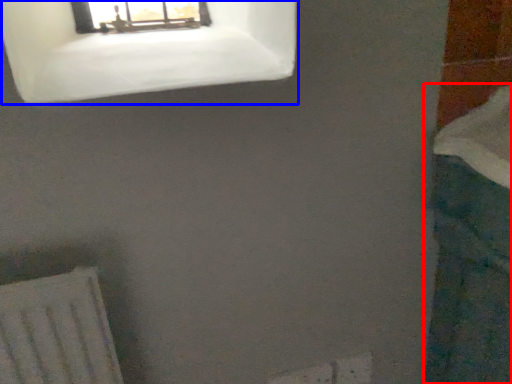
Question: Which point is further to the camera, bath (highlighted by a red box) or window (highlighted by a blue box)?

Choices:
 (A) bath
 (B) window

Answer: (B)